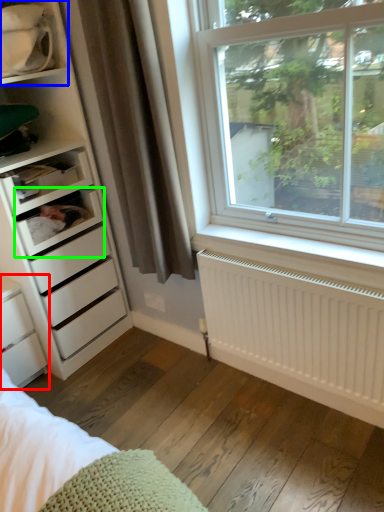
Question: Estimate the real-world distances between objects in this image. Which object is closer to chest of drawers (highlighted by a red box), shelf (highlighted by a blue box) or shelf (highlighted by a green box)?

Choices:
 (A) shelf
 (B) shelf

Answer: (B)